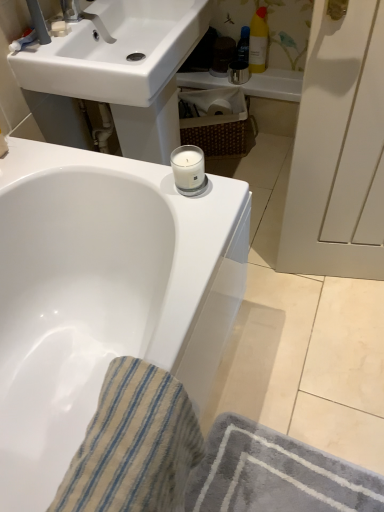
Find the location of a particular element. free space above beige striped cloth at lower left (from a real-world perspective) is located at coordinates (121, 418).